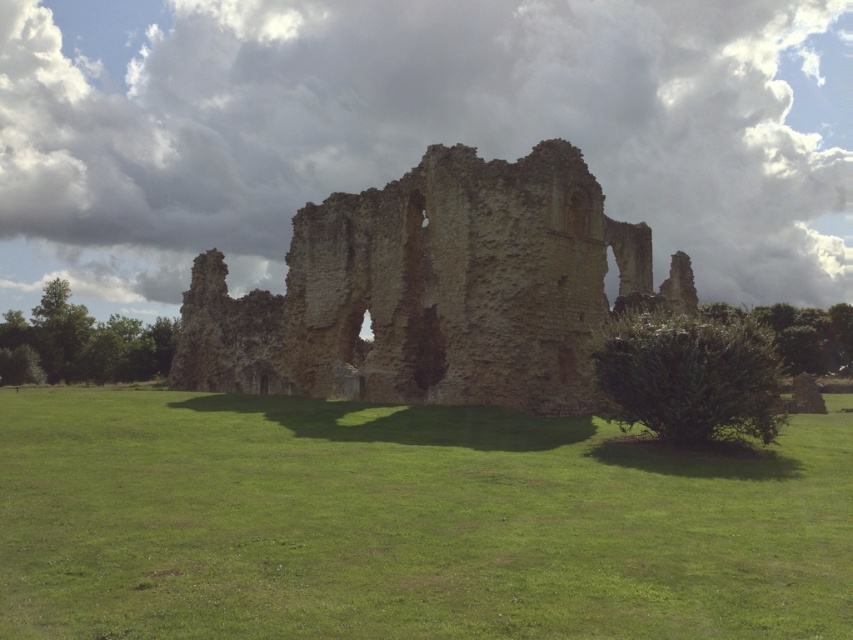
Question: Can you confirm if green grass at center is positioned above weathered stone castle at center?

Choices:
 (A) no
 (B) yes

Answer: (A)

Question: Is green grass at center above weathered stone castle at center?

Choices:
 (A) no
 (B) yes

Answer: (A)

Question: Can you confirm if green grass at center is thinner than weathered stone castle at center?

Choices:
 (A) yes
 (B) no

Answer: (A)

Question: Which point is farther from the camera taking this photo?

Choices:
 (A) (346, 566)
 (B) (386, 212)

Answer: (B)